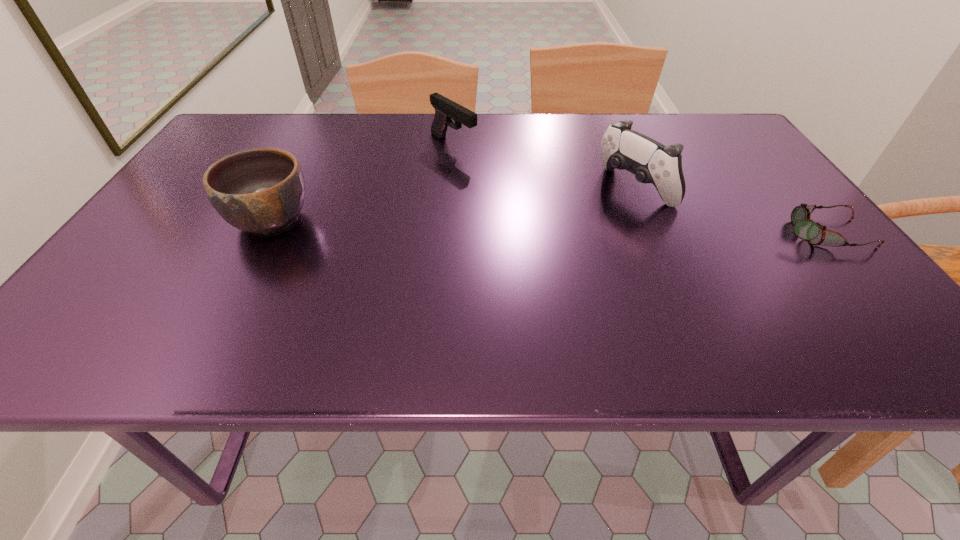
You are a GUI agent. You are given a task and a screenshot of the screen. Output one action in this format:
    pyautogui.click(x=<x>, y=<y>)
    Task: Click on the free spot between the pistol and the spectacles
    Image resolution: width=960 pixels, height=540 pixels.
    Given the screenshot: What is the action you would take?
    pyautogui.click(x=637, y=188)

The width and height of the screenshot is (960, 540). Find the location of `free space between the second object from right to left and the pistol`. free space between the second object from right to left and the pistol is located at coordinates (543, 166).

At what (x,y) coordinates should I click in order to perform the action: click on blank region between the third object from left to right and the pistol. Please return your answer as a coordinate pair (x, y). The image size is (960, 540). Looking at the image, I should click on (543, 166).

Identify the location of free point between the third object from left to right and the rightmost object. (728, 211).

This screenshot has height=540, width=960. Find the location of `free area in between the rightmost object and the leftmost object`. free area in between the rightmost object and the leftmost object is located at coordinates (546, 226).

What are the coordinates of `empty space between the bowl and the second object from right to left` in the screenshot? It's located at (453, 204).

Identify the location of free spot between the rightmost object and the bowl. (x=546, y=226).

In order to click on vacant area that lies between the leftmost object and the third object from right to left in this screenshot , I will do `click(362, 182)`.

Image resolution: width=960 pixels, height=540 pixels. I want to click on vacant space that is in between the control and the farthest object, so click(x=543, y=166).

The image size is (960, 540). I want to click on vacant area that lies between the second object from left to right and the third object from left to right, so click(543, 166).